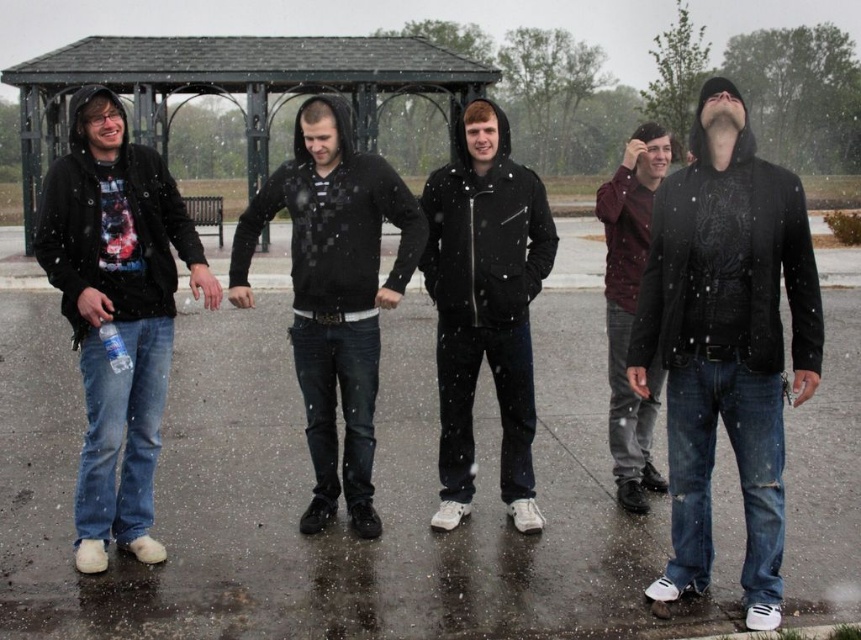
You are standing at the origin point in the park scene. Which direction should you walk to reach the matte black hoodie at center?

The matte black hoodie at center is located at point 0.458 on the x and 0.389 on the y coordinates. Since you are at the origin, you should move towards the positive x and y directions to reach it.

You are a photographer standing in the park and want to take a group photo of the two people wearing black matte hoodies. The minimum distance required between subjects for your camera to focus properly is 2 meters. Will the black matte hoodie at right and matte black hoodie at center be too close to each other for the camera to focus?

The black matte hoodie at right and matte black hoodie at center are 1.84 meters apart from each other, which is less than the required 2 meters. Therefore, the camera may not focus properly due to the insufficient distance between them.

You are standing in the park and see two points marked in the image. Which point, point (450, 195) or point (648, 468), is closer to you?

Point (450, 195) is closer to the viewer than point (648, 468).